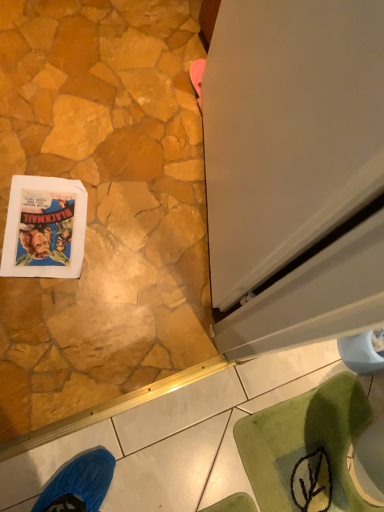
Image resolution: width=384 pixels, height=512 pixels. What are the coordinates of `free location above matte paper comic book at lower left (from a real-world perspective)` in the screenshot? It's located at (49, 224).